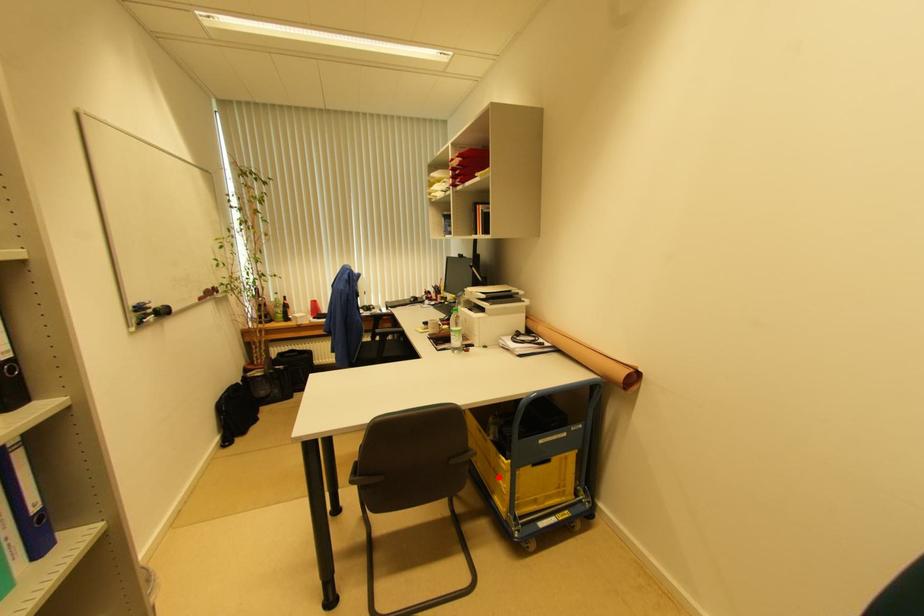
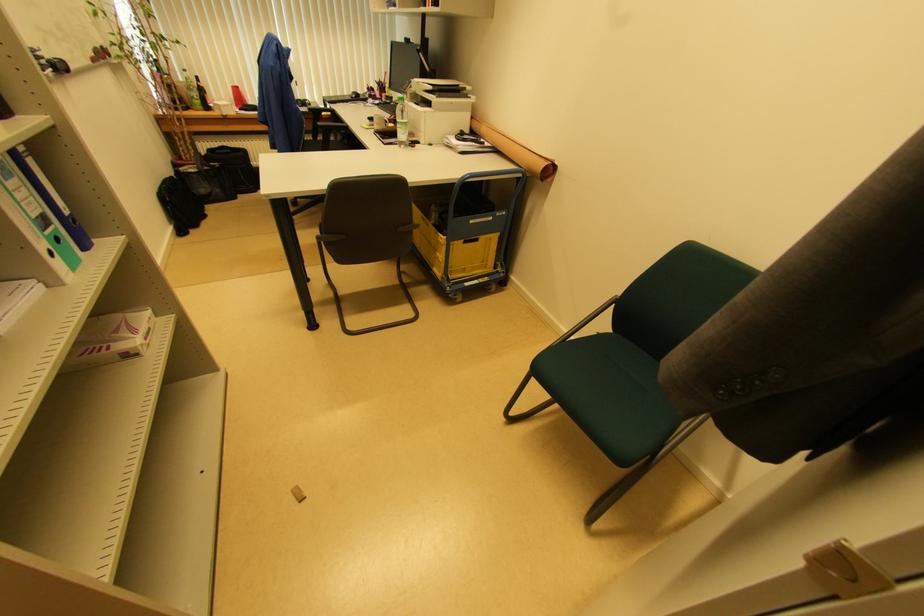
Question: A red point is marked in image1. In image2, is the corresponding 3D point closer to the camera or farther? Reply with the corresponding letter.

Choices:
 (A) The corresponding 3D point is closer.
 (B) The corresponding 3D point is farther.

Answer: (A)